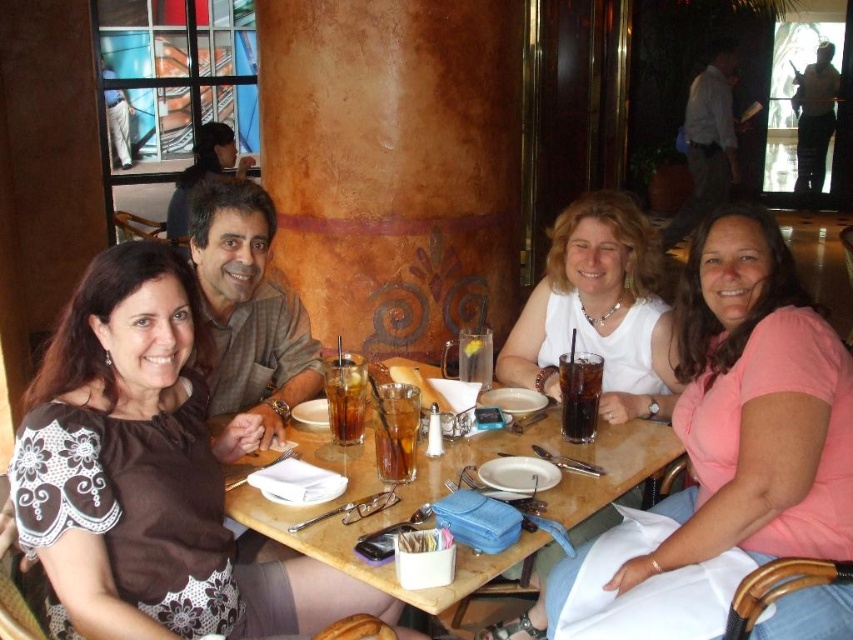
You are a photographer trying to capture a clear shot of both the matte white blouse at center and the white matte shirt at center from the same angle. Since both items are white, you need to adjust your camera settings to ensure proper exposure. Which item might require more adjustment because of its size?

The matte white blouse at center is larger in size than the white matte shirt at center, so it might require more adjustment because its larger surface area could affect the exposure settings more significantly.

You are a waiter in a restaurant and need to place a new drink order for the customer. The customer wants their drink to be as close as possible to the matte white blouse at center. Where should you place the new drink order relative to the dark glass cola at center?

The matte white blouse at center is positioned under the dark glass cola at center, so placing the new drink order directly below the dark glass cola at center would position it closest to the matte white blouse at center.

You are a waiter at the restaurant and need to deliver a drink to the table. You are currently standing to the right of the wooden table at center. Which direction should you move to reach the brown fabric dress at left?

The brown fabric dress at left is to the left of the wooden table at center. Since you are standing to the right of the wooden table at center, you should move to the left to reach the brown fabric dress at left.